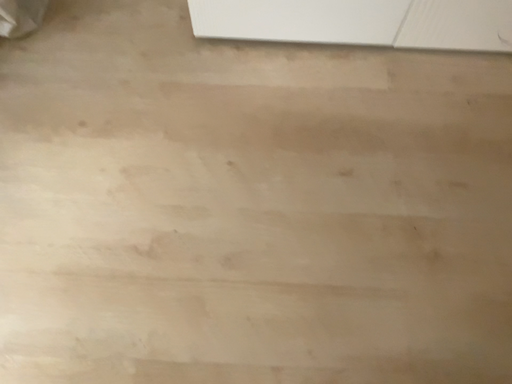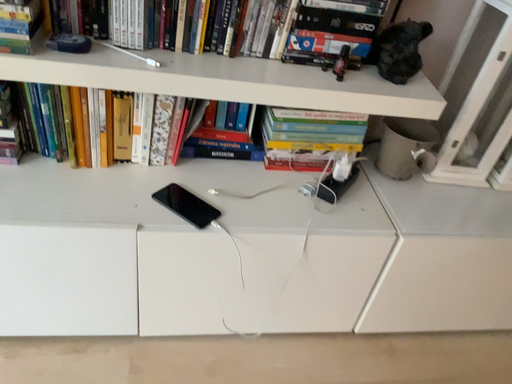
Question: How did the camera likely rotate when shooting the video?

Choices:
 (A) rotated right
 (B) rotated left

Answer: (A)